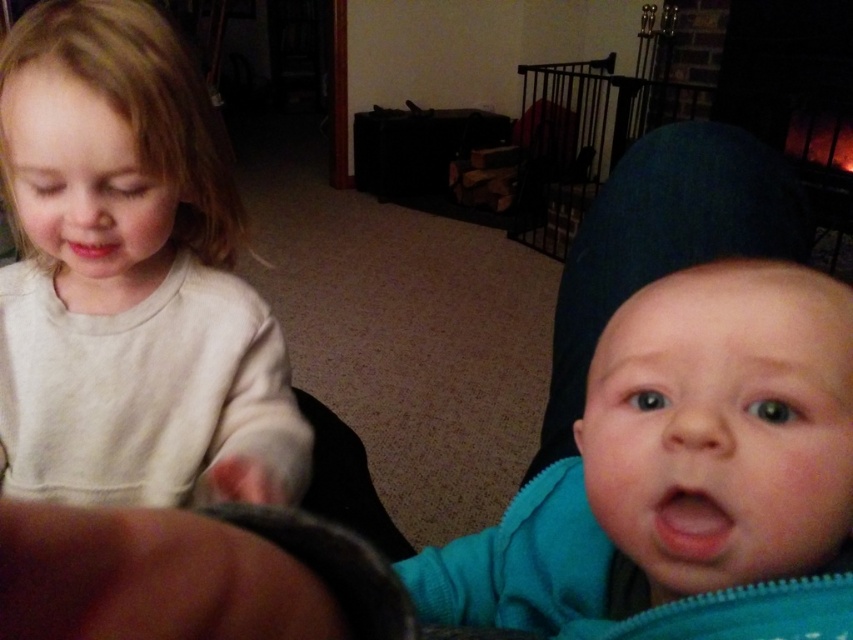
Based on the photo, you are a parent trying to dress your child. You see the light beige sweater at left and the teal zipper baby at center in the room. Which item is located higher up?

The light beige sweater at left is above the teal zipper baby at center, so it is located higher up.

You are a parent trying to decide whether to place a new toy between the light beige sweater at left and the teal zipper baby at center. Based on their positions, can the toy be placed in front of both objects without overlapping them?

The teal zipper baby at center is behind the light beige sweater at left, so placing the toy in front of both would require positioning it in front of the light beige sweater at left since it is closer to the viewer. The toy can be placed there without overlapping either object.